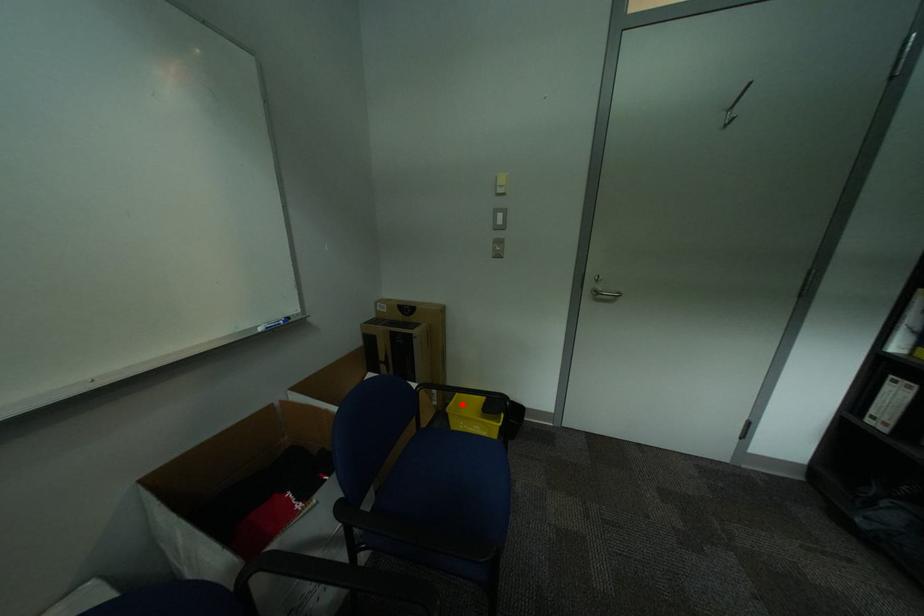
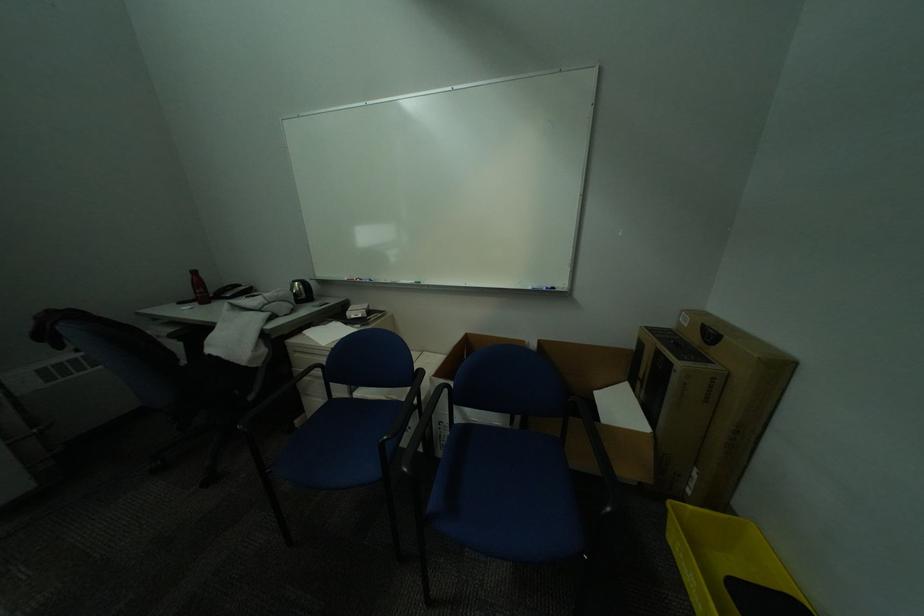
In the second image, find the point that corresponds to the highlighted location in the first image.

(701, 508)